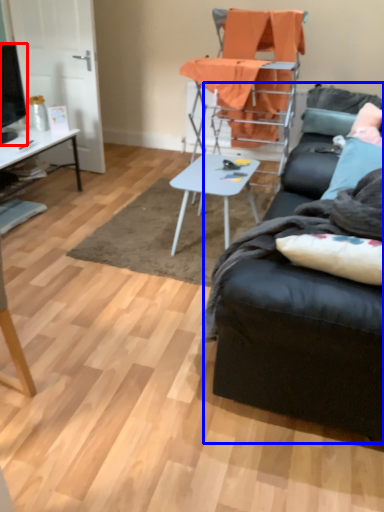
Question: Which object is further to the camera taking this photo, television (highlighted by a red box) or studio couch (highlighted by a blue box)?

Choices:
 (A) television
 (B) studio couch

Answer: (A)